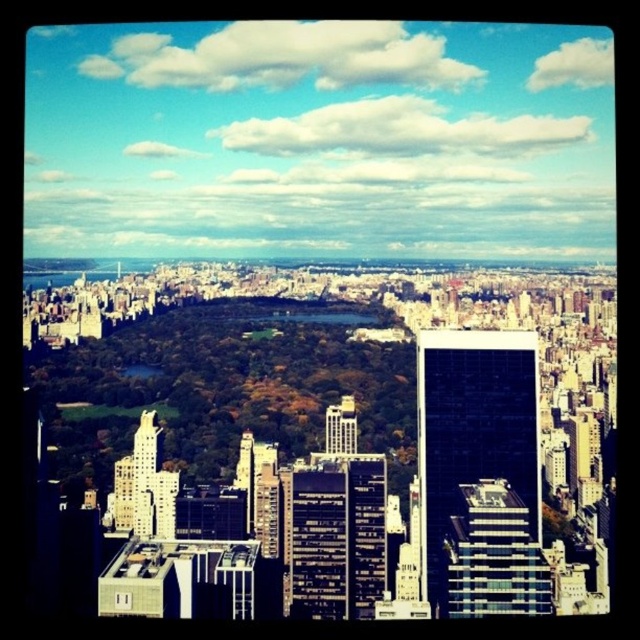
You are standing in the cityscape and want to take a photo of both the point at coordinates point (435, 337) and point (346, 403). Which point should you focus on first to ensure both are in focus?

You should focus on point (346, 403) first because it is closer to the camera than point (435, 337). By focusing on the closer point, the further point will also be in focus due to the depth of field.

You are standing at the center of Central Park and want to take a photo of the black glass building at right. Based on its 2D coordinates, in which direction should you point your camera?

The black glass building at right is located at coordinates (474, 426). Since the x coordinate is 0.666, which is greater than 0.5, and the y coordinate is 0.741, which is also greater than 0.5, you should point your camera to the upper right direction to capture the black glass building at right.